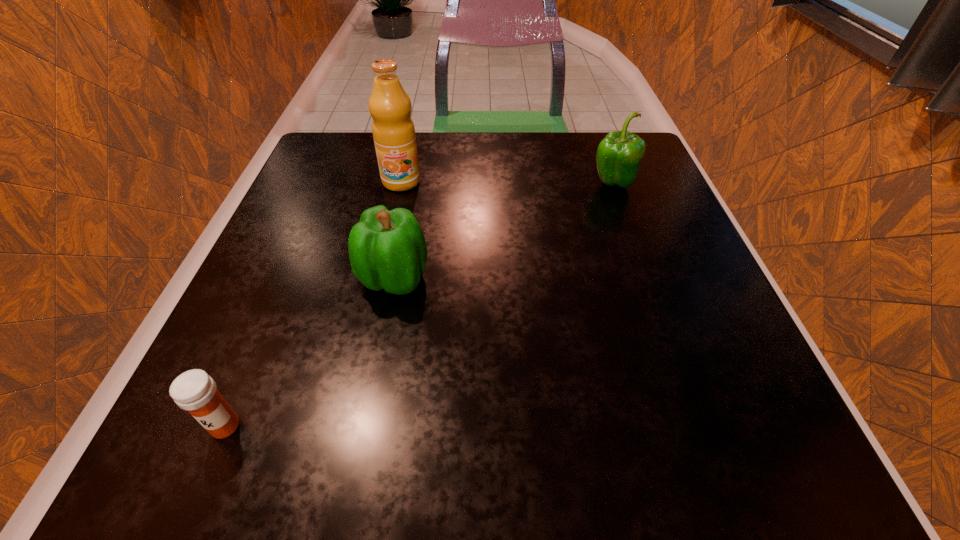
This screenshot has width=960, height=540. Identify the location of fruit juice. click(393, 130).

This screenshot has width=960, height=540. Find the location of `the rightmost object`. the rightmost object is located at coordinates (619, 154).

Find the location of `the farther bell pepper`. the farther bell pepper is located at coordinates (619, 154).

Find the location of a particular element. the second nearest object is located at coordinates 387,249.

Find the location of `the nearer bell pepper`. the nearer bell pepper is located at coordinates tap(387, 249).

Locate an element on the screen. Image resolution: width=960 pixels, height=540 pixels. the shortest object is located at coordinates (194, 390).

You are a GUI agent. You are given a task and a screenshot of the screen. Output one action in this format:
    pyautogui.click(x=<x>, y=<y>)
    Task: Click on the leftmost object
    This screenshot has width=960, height=540.
    Given the screenshot: What is the action you would take?
    pyautogui.click(x=194, y=390)

Where is `free space located 0.140m on the front label of the tallest object`? The image size is (960, 540). free space located 0.140m on the front label of the tallest object is located at coordinates (390, 236).

Locate an element on the screen. This screenshot has width=960, height=540. vacant space situated 0.330m on the front of the rightmost object is located at coordinates (661, 320).

This screenshot has width=960, height=540. I want to click on vacant space located 0.140m on the front of the left bell pepper, so click(x=374, y=381).